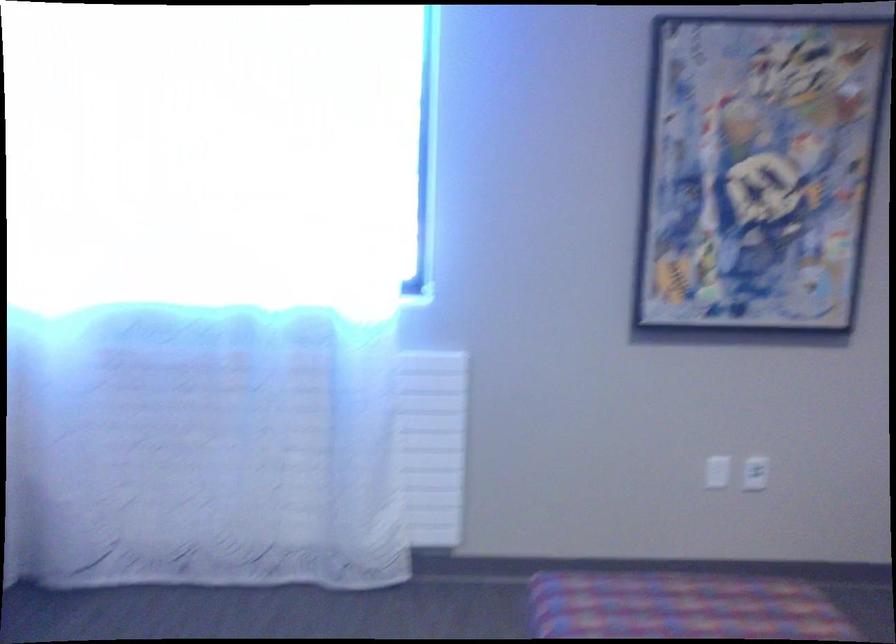
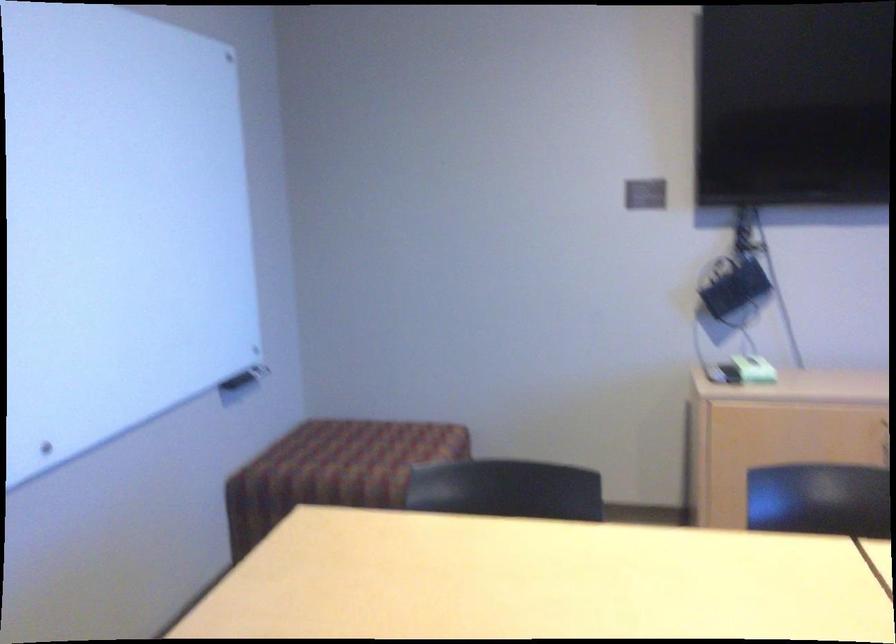
Question: The images are taken continuously from a first-person perspective. In which direction is your viewpoint rotating?

Choices:
 (A) Left
 (B) Right
 (C) Up
 (D) Down

Answer: (A)